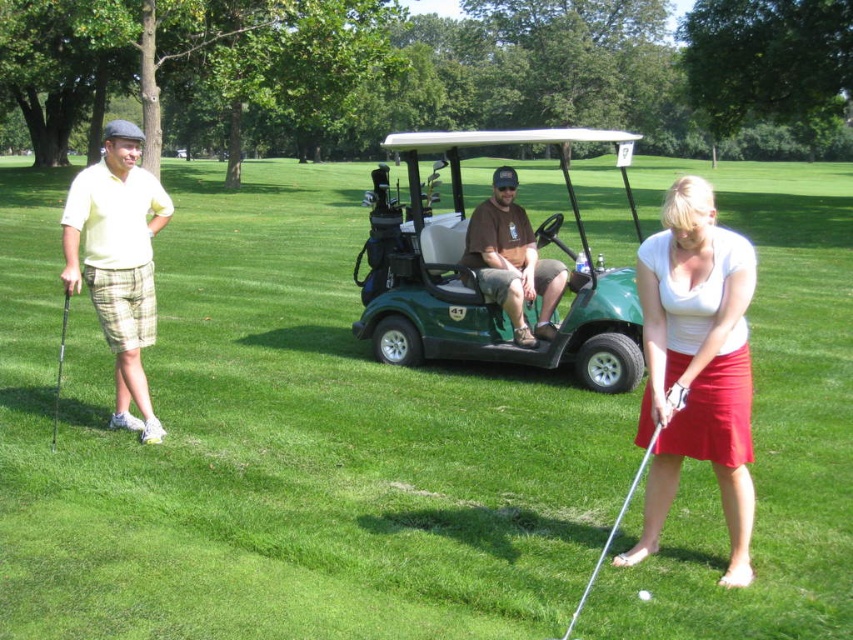
You are standing at the point labeled point (467, 136) and want to walk to the point labeled point (637, 548). Which direction should you move in to reach your destination?

Since point (467, 136) is behind point (637, 548), you should move forward towards point (637, 548) to reach your destination.

Consider the image. What are the coordinates of the green matte golf cart at center?

The green matte golf cart at center is located at point (479, 275).

You are a golfer trying to decide whether to wear the brown cotton shirt at center over the metallic silver golf club at lower right. Which item is wider?

The brown cotton shirt at center is wider than the metallic silver golf club at lower right.